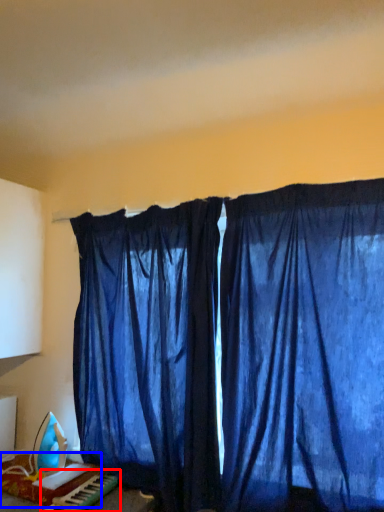
Question: Which object is closer to the camera taking this photo, musical keyboard (highlighted by a red box) or furniture (highlighted by a blue box)?

Choices:
 (A) musical keyboard
 (B) furniture

Answer: (A)